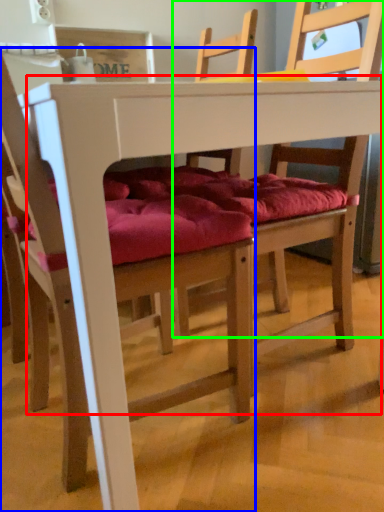
Question: Which object is positioned closest to table (highlighted by a red box)? Select from chair (highlighted by a blue box) and chair (highlighted by a green box).

Choices:
 (A) chair
 (B) chair

Answer: (A)